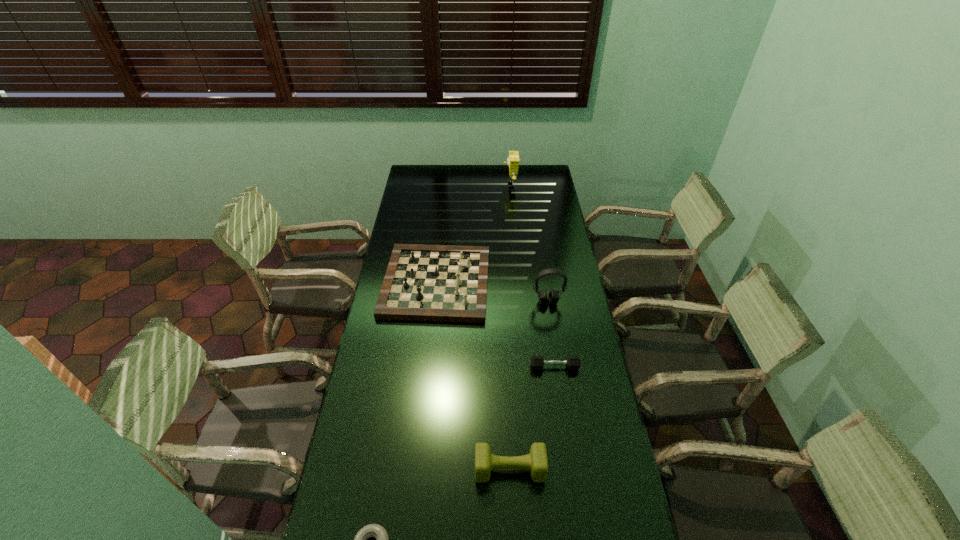
This screenshot has width=960, height=540. What are the coordinates of `free space located 0.140m on the front-facing side of the headset` in the screenshot? It's located at (553, 334).

The height and width of the screenshot is (540, 960). I want to click on vacant space located 0.360m on the right of the chessboard, so click(575, 283).

Image resolution: width=960 pixels, height=540 pixels. I want to click on vacant region located on the left of the taller dumbbell, so click(x=351, y=469).

I want to click on vacant space located 0.160m on the back of the shorter dumbbell, so click(x=548, y=327).

I want to click on object present at the far edge, so click(513, 160).

You are a GUI agent. You are given a task and a screenshot of the screen. Output one action in this format:
    pyautogui.click(x=<x>, y=<y>)
    Task: Click on the object that is at the left edge
    Image resolution: width=960 pixels, height=540 pixels.
    Given the screenshot: What is the action you would take?
    pyautogui.click(x=448, y=283)

Where is `headset located in the right edge section of the desktop`? headset located in the right edge section of the desktop is located at coordinates (553, 297).

The height and width of the screenshot is (540, 960). Identify the location of dumbbell at the right edge. (537, 362).

Find the location of a particular element. The height and width of the screenshot is (540, 960). vacant space at the far edge is located at coordinates (472, 182).

This screenshot has width=960, height=540. What are the coordinates of `free spot at the left edge of the desktop` in the screenshot? It's located at (377, 409).